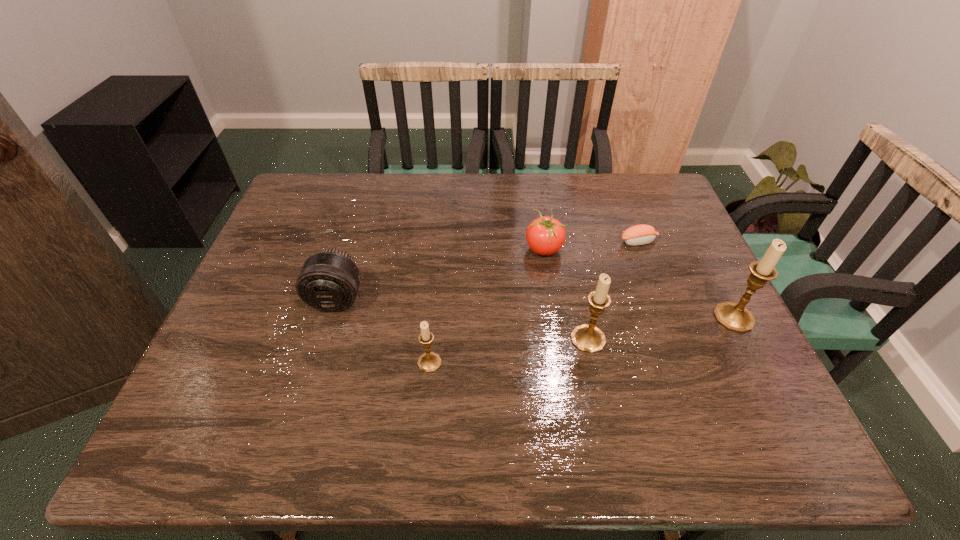
Find the location of a particular element. free location located 0.340m on the back of the second candle holder from left to right is located at coordinates (566, 233).

You are a GUI agent. You are given a task and a screenshot of the screen. Output one action in this format:
    pyautogui.click(x=<x>, y=<y>)
    Task: Click on the vacant area located 0.070m on the front of the rightmost object
    
    Given the screenshot: What is the action you would take?
    point(755,358)

Identify the location of free space located on the front of the sushi. The height and width of the screenshot is (540, 960). 661,301.

Identify the location of vacant space positioned on the front-facing side of the leftmost object. The width and height of the screenshot is (960, 540). (323, 347).

The width and height of the screenshot is (960, 540). I want to click on blank space located on the front of the tomato, so click(564, 379).

At what (x,y) coordinates should I click in order to perform the action: click on object that is at the near edge. Please return your answer as a coordinate pair (x, y). The width and height of the screenshot is (960, 540). Looking at the image, I should click on (429, 362).

Identify the location of candle holder that is at the right edge. This screenshot has width=960, height=540. (735, 317).

This screenshot has height=540, width=960. Find the location of `sushi present at the right edge`. sushi present at the right edge is located at coordinates (642, 234).

This screenshot has width=960, height=540. I want to click on free spot at the far edge of the desktop, so click(x=562, y=186).

In the image, there is a desktop. In order to click on free region at the near edge in this screenshot , I will do `click(627, 392)`.